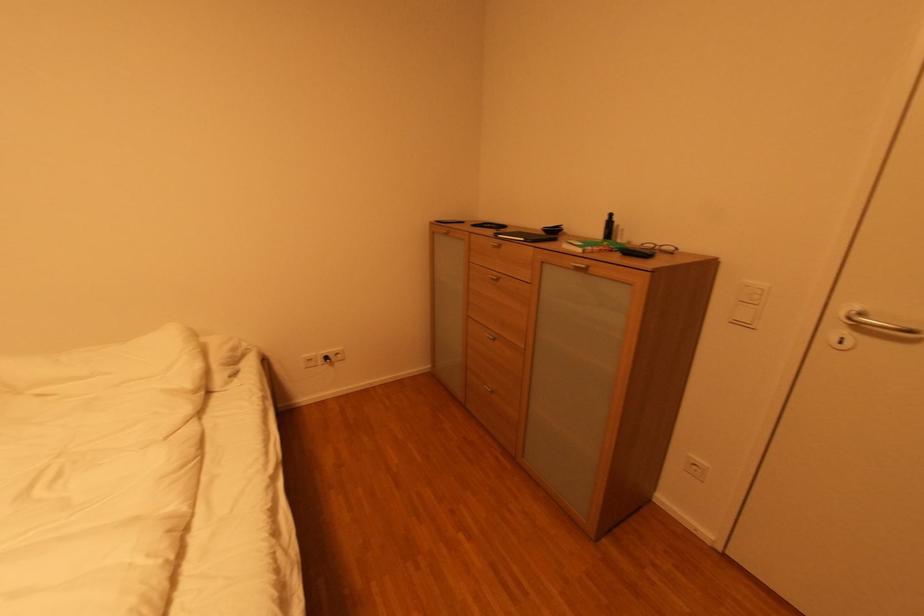
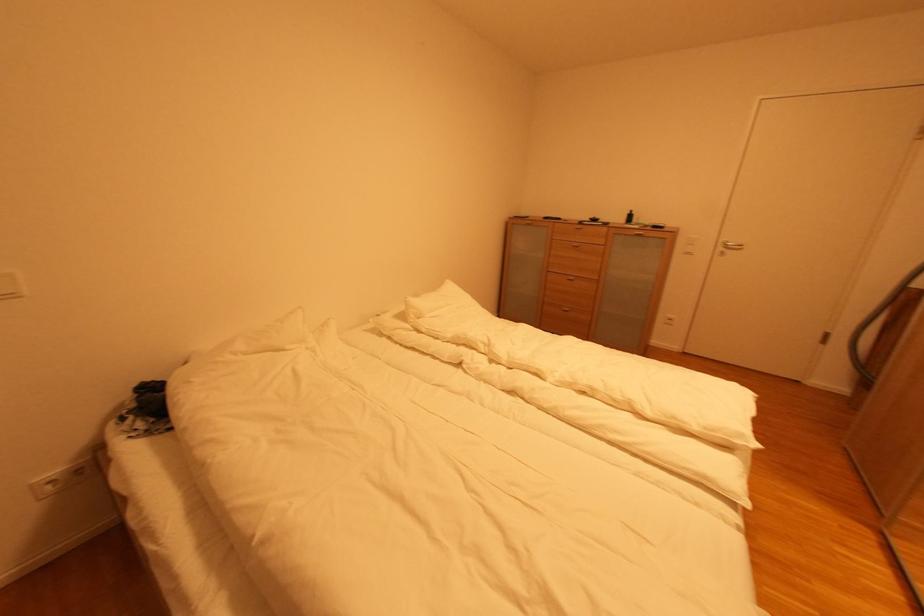
Which direction would the cameraman need to move to produce the second image?

The movement direction of the cameraman is left, backward.